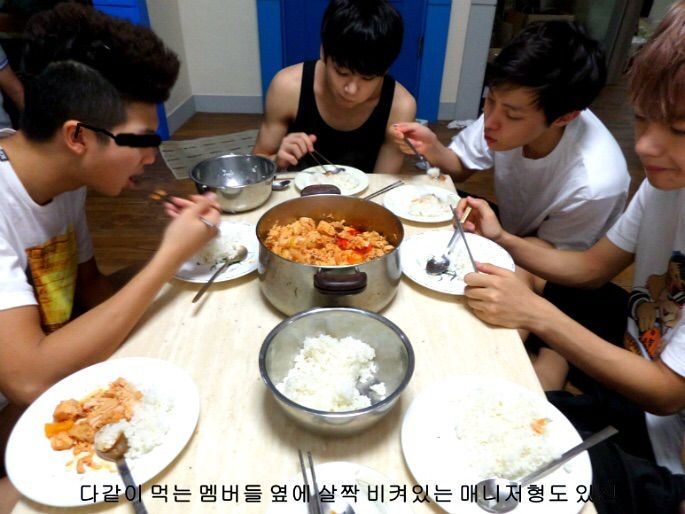
The width and height of the screenshot is (685, 514). I want to click on silver pot, so click(x=381, y=282).